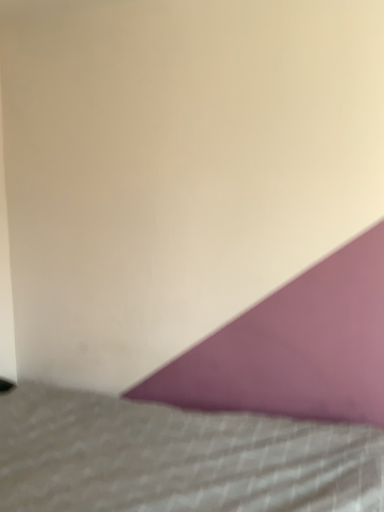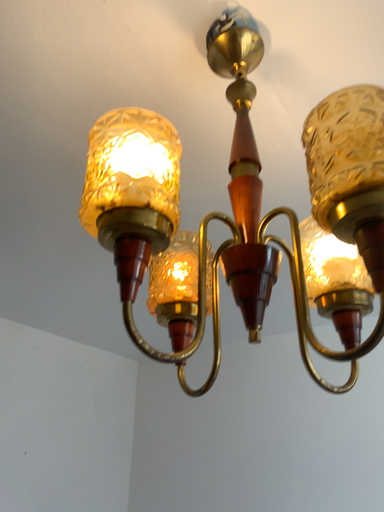
Question: How did the camera likely rotate when shooting the video?

Choices:
 (A) rotated right
 (B) rotated left

Answer: (B)